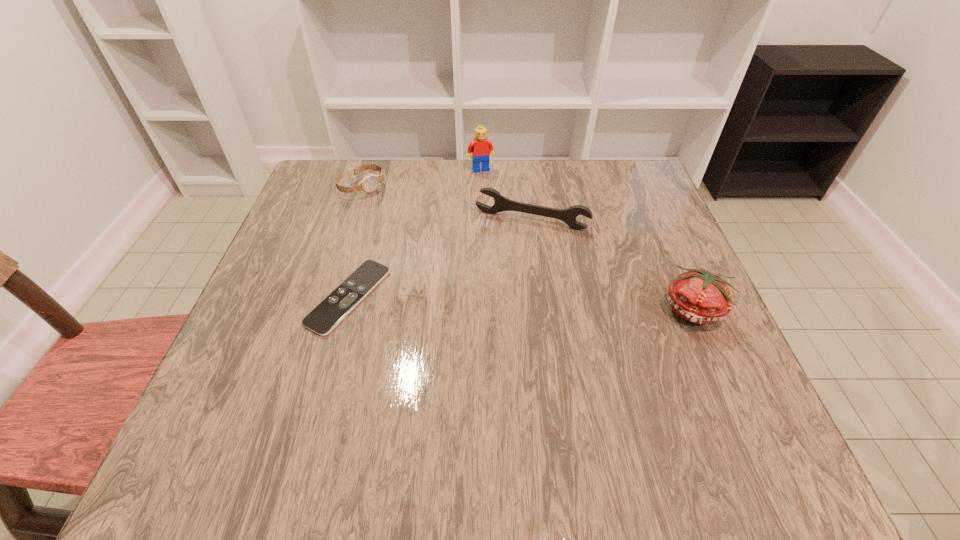
In order to click on vacant space at the right edge in this screenshot , I will do `click(652, 341)`.

Find the location of a particular element. Image resolution: width=960 pixels, height=540 pixels. vacant area at the far left corner is located at coordinates (324, 186).

This screenshot has width=960, height=540. In order to click on blank space at the far right corner of the desktop in this screenshot , I will do `click(625, 192)`.

Identify the location of vacant space at the near right corner. Image resolution: width=960 pixels, height=540 pixels. (746, 384).

The height and width of the screenshot is (540, 960). In order to click on empty location between the rightmost object and the remote control in this screenshot , I will do `click(521, 303)`.

Image resolution: width=960 pixels, height=540 pixels. I want to click on free area in between the shortest object and the tomato, so click(x=521, y=303).

Identify the location of free space between the remote control and the tallest object. Image resolution: width=960 pixels, height=540 pixels. (415, 233).

Find the location of a particular element. vacant area that lies between the remote control and the watch is located at coordinates (355, 241).

Where is `free spot between the shortest object and the fourth nearest object`? free spot between the shortest object and the fourth nearest object is located at coordinates (355, 241).

This screenshot has width=960, height=540. I want to click on vacant area that lies between the farthest object and the shortest object, so click(x=415, y=233).